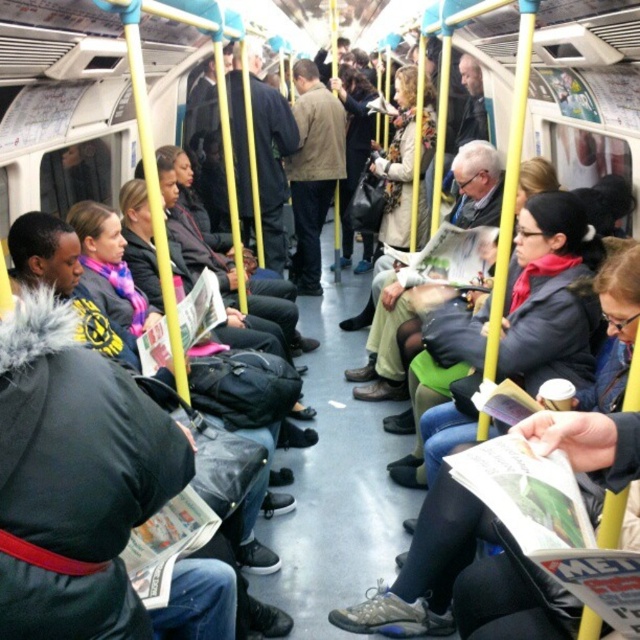
Looking at this image, you are a passenger on a crowded subway train and want to place your bag between the brown leather jacket at center and the dark blue jacket at center. The bag measures 20 inches in length. Will there be enough space between the two jackets to fit your bag?

The brown leather jacket at center is 23.38 inches away from the dark blue jacket at center. Since the bag is 20 inches long, there is sufficient space to fit it between them.